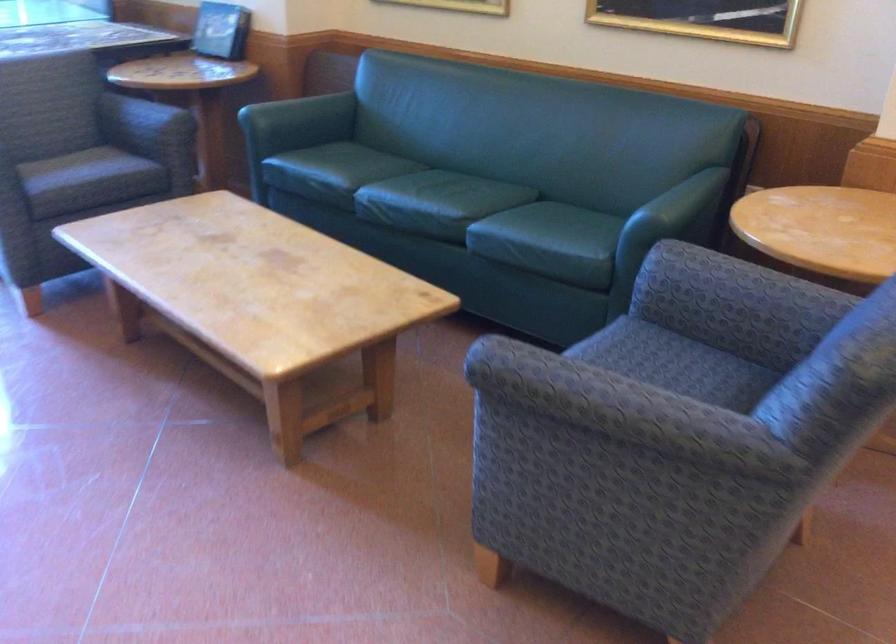
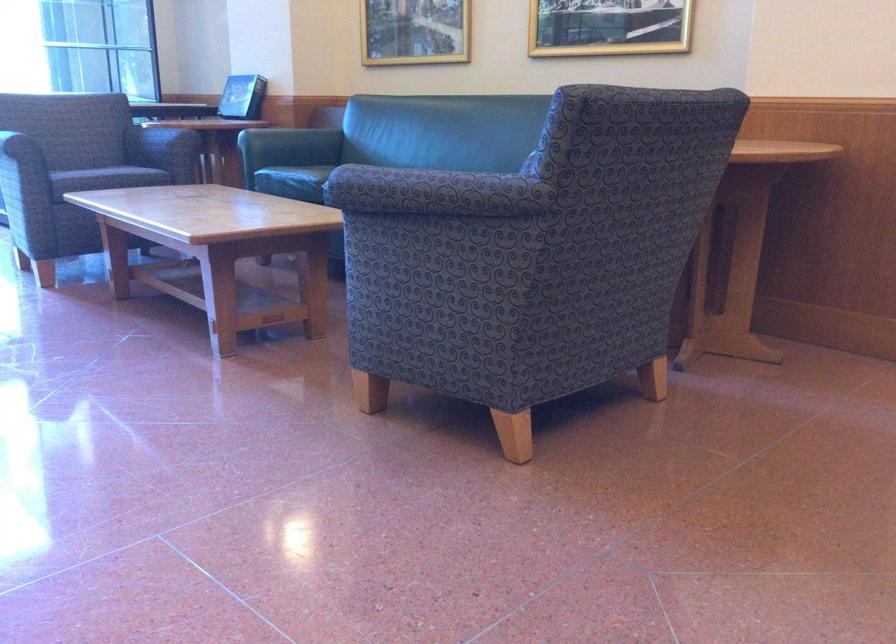
The point at (306, 124) is marked in the first image. Where is the corresponding point in the second image?

(290, 145)